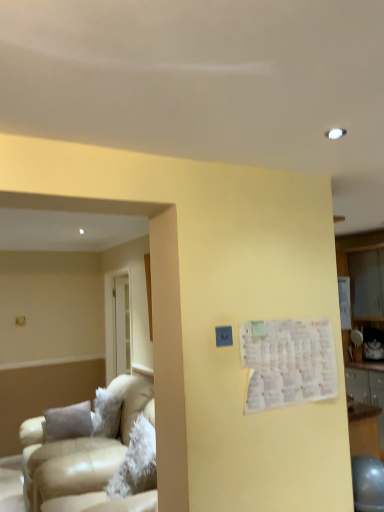
Question: Should I look upward or downward to see beige leather couch at left?

Choices:
 (A) down
 (B) up

Answer: (A)

Question: Is white paper at upper right beside beige leather couch at left?

Choices:
 (A) yes
 (B) no

Answer: (B)

Question: Considering the relative sizes of white paper at upper right and beige leather couch at left in the image provided, is white paper at upper right wider than beige leather couch at left?

Choices:
 (A) no
 (B) yes

Answer: (A)

Question: Considering the relative positions of white paper at upper right and beige leather couch at left in the image provided, is white paper at upper right in front of beige leather couch at left?

Choices:
 (A) yes
 (B) no

Answer: (A)

Question: Considering the relative sizes of white paper at upper right and beige leather couch at left in the image provided, is white paper at upper right smaller than beige leather couch at left?

Choices:
 (A) yes
 (B) no

Answer: (A)

Question: Can beige leather couch at left be found inside white paper at upper right?

Choices:
 (A) yes
 (B) no

Answer: (B)

Question: Is white paper at upper right shorter than beige leather couch at left?

Choices:
 (A) yes
 (B) no

Answer: (A)

Question: From a real-world perspective, is beige leather couch at left positioned under white paper at upper right based on gravity?

Choices:
 (A) yes
 (B) no

Answer: (A)

Question: Can you confirm if beige leather couch at left is positioned to the right of white paper at upper right?

Choices:
 (A) yes
 (B) no

Answer: (B)

Question: From the image's perspective, is beige leather couch at left under white paper at upper right?

Choices:
 (A) no
 (B) yes

Answer: (B)

Question: Is beige leather couch at left taller than white paper at upper right?

Choices:
 (A) no
 (B) yes

Answer: (B)

Question: Does beige leather couch at left have a larger size compared to white paper at upper right?

Choices:
 (A) yes
 (B) no

Answer: (A)

Question: Is beige leather couch at left with white paper at upper right?

Choices:
 (A) no
 (B) yes

Answer: (A)

Question: From the image's perspective, is white paper at upper right above or below beige leather couch at left?

Choices:
 (A) above
 (B) below

Answer: (A)